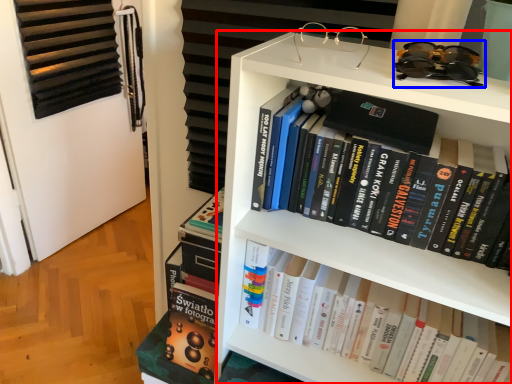
Question: Which of the following is the farthest to the observer, bookcase (highlighted by a red box) or glasses (highlighted by a blue box)?

Choices:
 (A) bookcase
 (B) glasses

Answer: (A)